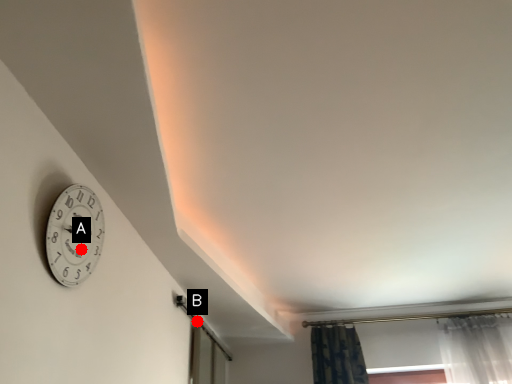
Question: Two points are circled on the image, labeled by A and B beside each circle. Among these points, which one is nearest to the camera?

Choices:
 (A) A is closer
 (B) B is closer

Answer: (A)